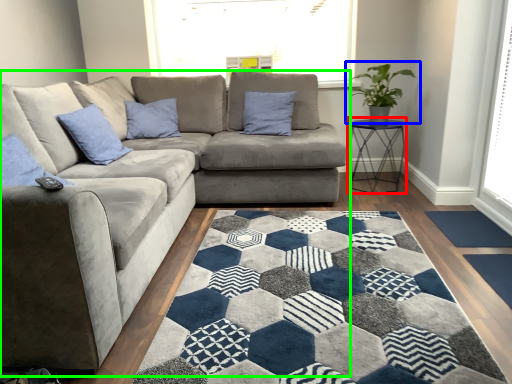
Question: Considering the real-world distances, which object is closest to table (highlighted by a red box)? houseplant (highlighted by a blue box) or studio couch (highlighted by a green box).

Choices:
 (A) houseplant
 (B) studio couch

Answer: (A)